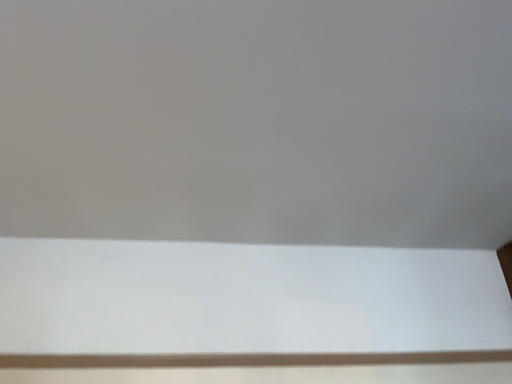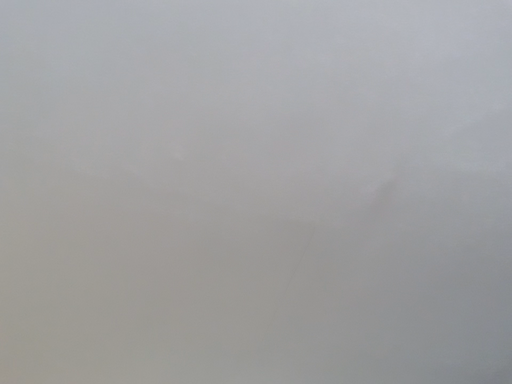
Question: Which way did the camera rotate in the video?

Choices:
 (A) rotated upward
 (B) rotated downward

Answer: (A)